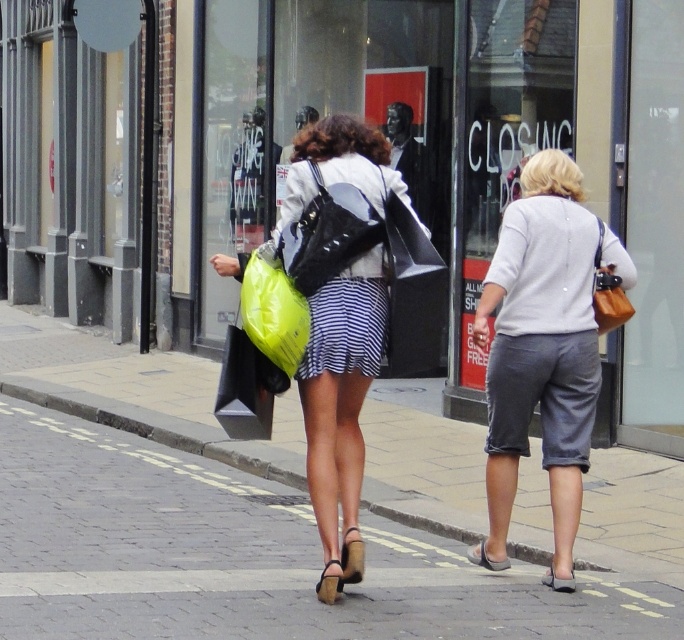
Question: Among these objects, which one is nearest to the camera?

Choices:
 (A) matte black backpack at center
 (B) brick pavement at center

Answer: (B)

Question: Which of the following is the farthest from the observer?

Choices:
 (A) (629, 420)
 (B) (332, 545)

Answer: (A)

Question: Which object is closer to the camera taking this photo?

Choices:
 (A) matte black backpack at center
 (B) neon yellow plastic bag at center
 (C) gray cotton shorts at center
 (D) matte black sign at center

Answer: (B)

Question: Can you confirm if brick pavement at center is thinner than striped fabric dress at center?

Choices:
 (A) no
 (B) yes

Answer: (A)

Question: Can you confirm if matte black backpack at center is thinner than neon yellow plastic bag at center?

Choices:
 (A) no
 (B) yes

Answer: (A)

Question: Does matte black backpack at center have a greater width compared to neon yellow plastic bag at center?

Choices:
 (A) no
 (B) yes

Answer: (B)